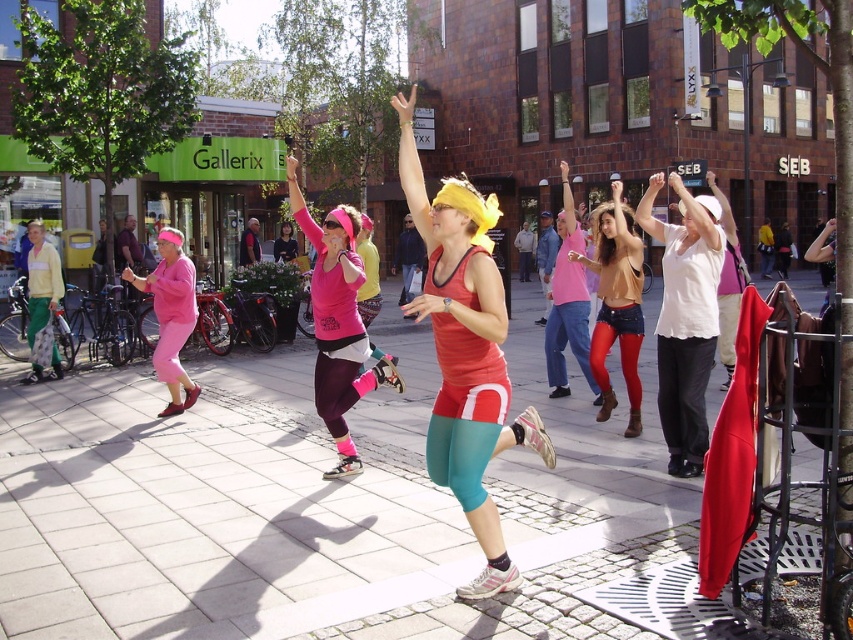
Question: Does white tile pavement at center lie in front of matte pink leggings at left?

Choices:
 (A) yes
 (B) no

Answer: (A)

Question: Estimate the real-world distances between objects in this image. Which object is farther from the matte brown leather boots at center?

Choices:
 (A) matte pink leggings at left
 (B) pink matte leggings at center
 (C) matte red tank top at center
 (D) white tile pavement at center

Answer: (A)

Question: Which of the following is the closest to the observer?

Choices:
 (A) (345, 214)
 (B) (173, 340)
 (C) (78, 580)
 (D) (589, 262)

Answer: (C)

Question: Is the position of matte brown leather boots at center less distant than that of matte pink leggings at left?

Choices:
 (A) no
 (B) yes

Answer: (B)

Question: Does pink matte leggings at center appear on the right side of matte brown leather boots at center?

Choices:
 (A) yes
 (B) no

Answer: (B)

Question: Estimate the real-world distances between objects in this image. Which object is closer to the pink matte leggings at center?

Choices:
 (A) matte brown leather boots at center
 (B) matte red tank top at center

Answer: (B)